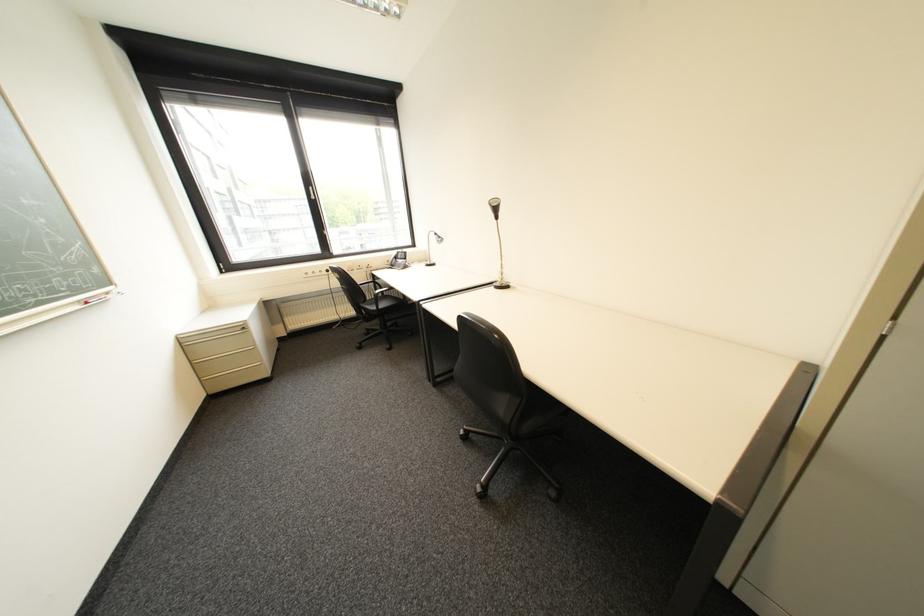
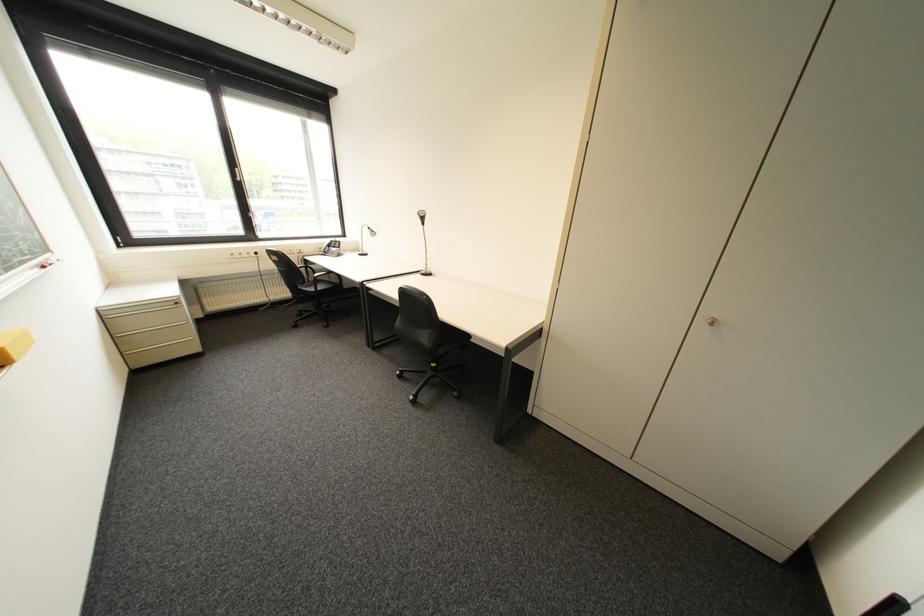
Question: I am providing you with two images of the same scene from different viewpoints. Which of the following objects are not visible in image2?

Choices:
 (A) cabinet drawer handle
 (B) silver cabinet knob
 (C) black chair armrest
 (D) none of these

Answer: (D)